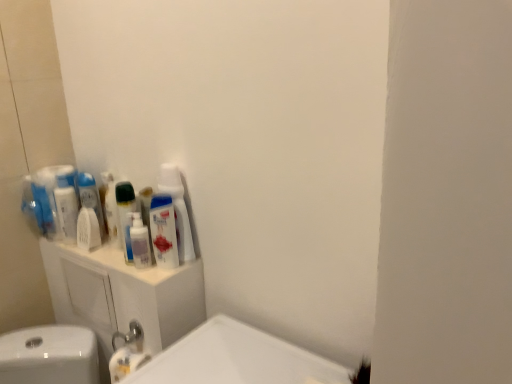
You are a GUI agent. You are given a task and a screenshot of the screen. Output one action in this format:
    pyautogui.click(x=<x>, y=<y>)
    Task: Click on the vacant space situated on the left part of translucent plastic mouthwash at upper left, the 1th mouthwash viewed from the right
    
    Given the screenshot: What is the action you would take?
    pyautogui.click(x=118, y=266)